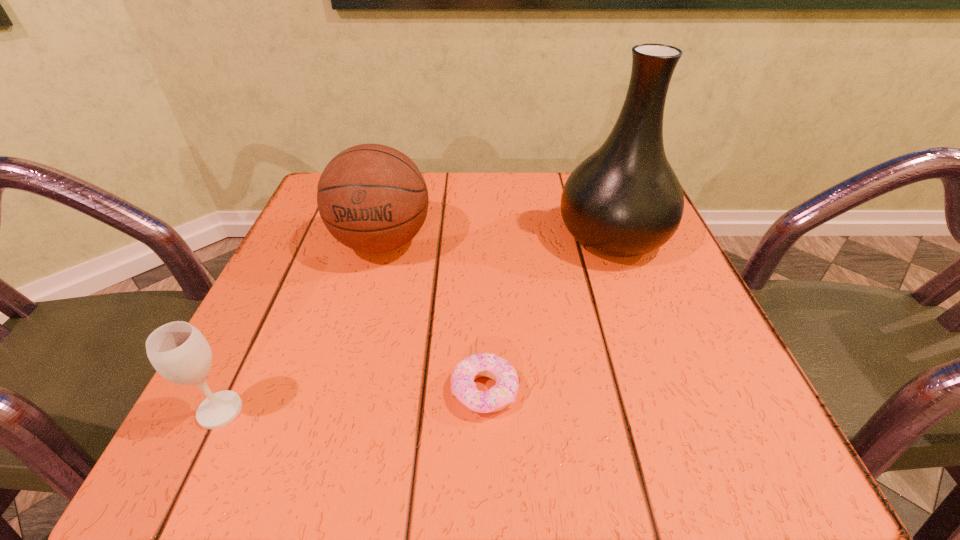
Locate an element on the screen. object that is at the near left corner is located at coordinates (178, 351).

Where is `object present at the far right corner`? The width and height of the screenshot is (960, 540). object present at the far right corner is located at coordinates (624, 200).

Identify the location of vacant space at the far edge. Image resolution: width=960 pixels, height=540 pixels. (511, 192).

Where is `vacant space at the left edge of the desktop`? The height and width of the screenshot is (540, 960). vacant space at the left edge of the desktop is located at coordinates pos(313,258).

Locate an element on the screen. The width and height of the screenshot is (960, 540). vacant space at the right edge of the desktop is located at coordinates (631, 322).

The height and width of the screenshot is (540, 960). What are the coordinates of `free point between the third shortest object and the third object from left to right` in the screenshot? It's located at (433, 316).

Find the location of a particular element. This screenshot has width=960, height=540. vacant space that is in between the vase and the wineglass is located at coordinates (417, 323).

Locate an element on the screen. The width and height of the screenshot is (960, 540). blank region between the second shortest object and the second object from left to right is located at coordinates (301, 326).

Locate an element on the screen. unoccupied area between the second object from left to right and the leftmost object is located at coordinates (301, 326).

Image resolution: width=960 pixels, height=540 pixels. In order to click on free point between the basketball and the tallest object in this screenshot , I will do `click(497, 240)`.